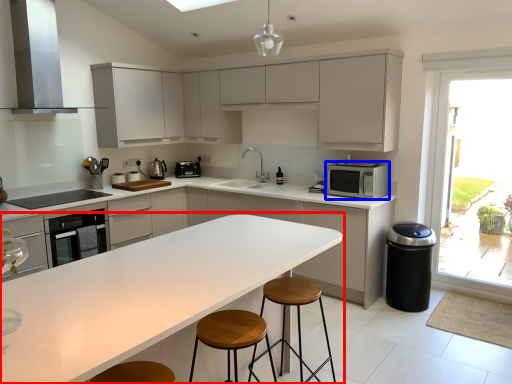
Question: Which object appears farthest to the camera in this image, countertop (highlighted by a red box) or microwave oven (highlighted by a blue box)?

Choices:
 (A) countertop
 (B) microwave oven

Answer: (B)